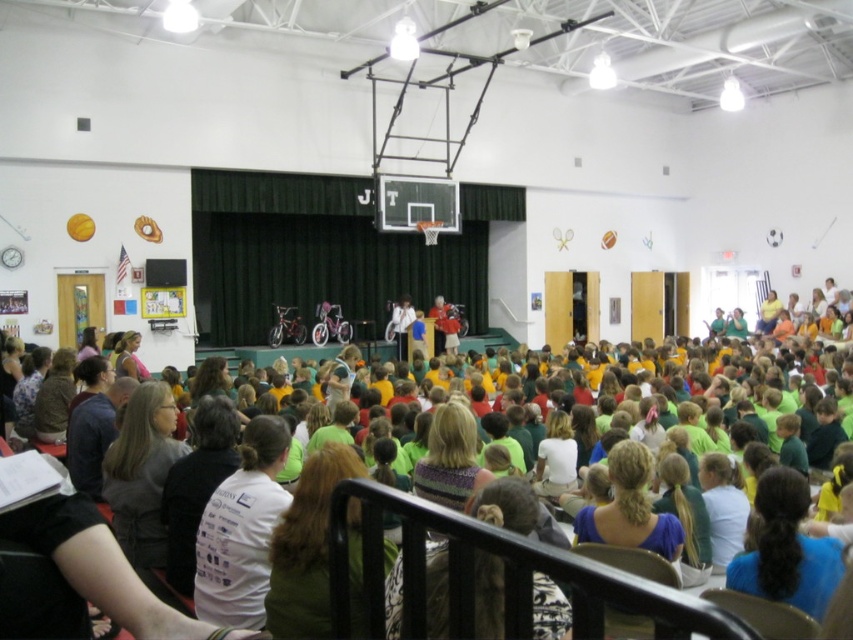
Question: Is the position of white matte shirt at lower center more distant than that of green fabric shirt at lower center?

Choices:
 (A) yes
 (B) no

Answer: (A)

Question: Does white matte shirt at lower center have a larger size compared to green fabric shirt at lower center?

Choices:
 (A) yes
 (B) no

Answer: (B)

Question: Among these objects, which one is farthest from the camera?

Choices:
 (A) green fabric shirt at lower center
 (B) gray fabric at lower left
 (C) white matte shirt at lower center
 (D) blue fabric ponytail at lower right

Answer: (B)

Question: Which point appears closest to the camera in this image?

Choices:
 (A) (337, 449)
 (B) (131, 484)

Answer: (A)

Question: Considering the real-world distances, which object is closest to the green fabric shirt at lower center?

Choices:
 (A) gray fabric at lower left
 (B) blue fabric ponytail at lower right
 (C) white matte shirt at lower center

Answer: (C)

Question: Is white matte shirt at lower center smaller than gray fabric at lower left?

Choices:
 (A) no
 (B) yes

Answer: (B)